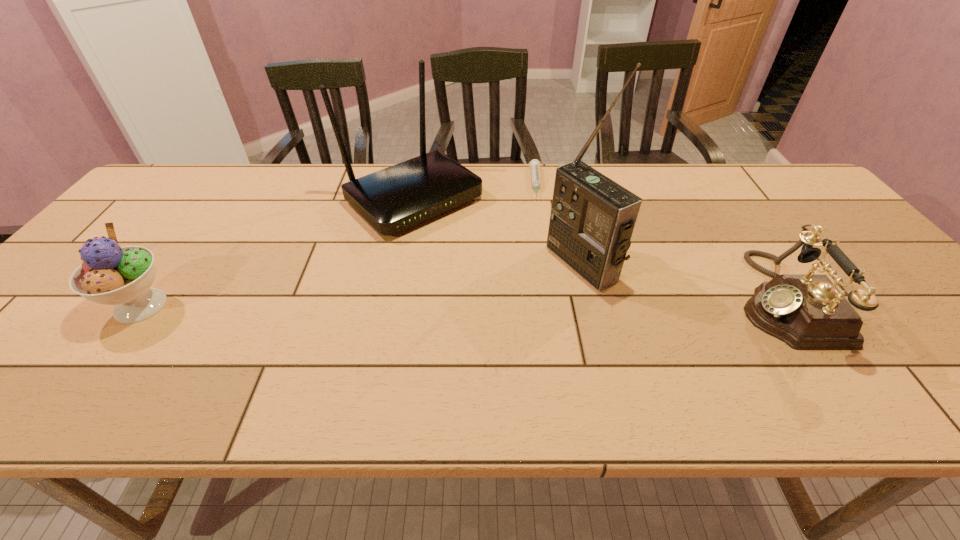
This screenshot has width=960, height=540. What are the coordinates of `syringe that is at the far edge` in the screenshot? It's located at (534, 164).

The height and width of the screenshot is (540, 960). What are the coordinates of `object at the near edge` in the screenshot? It's located at (807, 312).

At what (x,y) coordinates should I click in order to perform the action: click on object at the left edge. Please return your answer as a coordinate pair (x, y). This screenshot has width=960, height=540. Looking at the image, I should click on (110, 275).

This screenshot has height=540, width=960. In the image, there is a desktop. Find the location of `vacant space at the far edge`. vacant space at the far edge is located at coordinates (526, 172).

Where is `vacant space at the near edge of the desktop`? vacant space at the near edge of the desktop is located at coordinates (761, 340).

In the image, there is a desktop. Where is `vacant space at the right edge`? The height and width of the screenshot is (540, 960). vacant space at the right edge is located at coordinates (774, 207).

The width and height of the screenshot is (960, 540). In order to click on free region at the far right corner of the desktop in this screenshot , I will do `click(763, 174)`.

The width and height of the screenshot is (960, 540). I want to click on free space between the rightmost object and the icecream, so click(461, 302).

The image size is (960, 540). I want to click on empty location between the icecream and the syringe, so click(x=339, y=245).

What are the coordinates of `free space between the router and the leftmost object` in the screenshot? It's located at (277, 253).